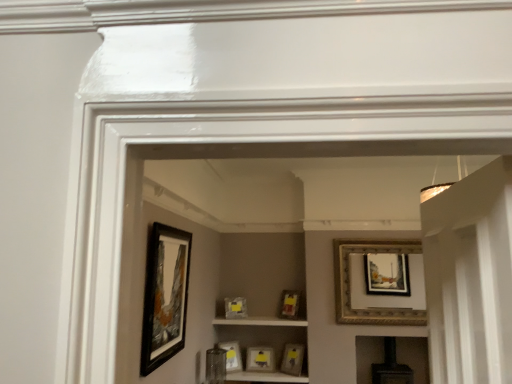
Question: From the image's perspective, is matte gold picture frame at center, the 5th picture frame when ordered from left to right, located above or below matte black picture frame at center, acting as the 4th picture frame starting from the right?

Choices:
 (A) above
 (B) below

Answer: (A)

Question: Is matte gold picture frame at center, arranged as the 5th picture frame when viewed from the front, taller or shorter than matte black picture frame at center, placed as the second picture frame when sorted from back to front?

Choices:
 (A) short
 (B) tall

Answer: (B)

Question: Estimate the real-world distances between objects in this image. Which object is closer to the matte yellow picture frame at center, the fifth picture frame from the back?

Choices:
 (A) matte black picture frame at center, the 4th picture frame viewed from the back
 (B) gold ornate picture frame at upper right, placed as the first picture frame when sorted from right to left
 (C) black matte picture frame at left, placed as the 1th picture frame when sorted from left to right
 (D) matte gold picture frame at center, the 5th picture frame when ordered from left to right
 (E) matte glass cabinet at center

Answer: (E)

Question: Estimate the real-world distances between objects in this image. Which object is closer to the matte gray picture frame at center, arranged as the 3th picture frame when viewed from the left?

Choices:
 (A) matte glass cabinet at center
 (B) matte black picture frame at center, acting as the 4th picture frame starting from the right
 (C) gold ornate picture frame at upper right, placed as the first picture frame when sorted from right to left
 (D) matte yellow picture frame at center, the fifth picture frame from the back
 (E) black matte picture frame at left, which is counted as the 1th picture frame, starting from the front

Answer: (A)